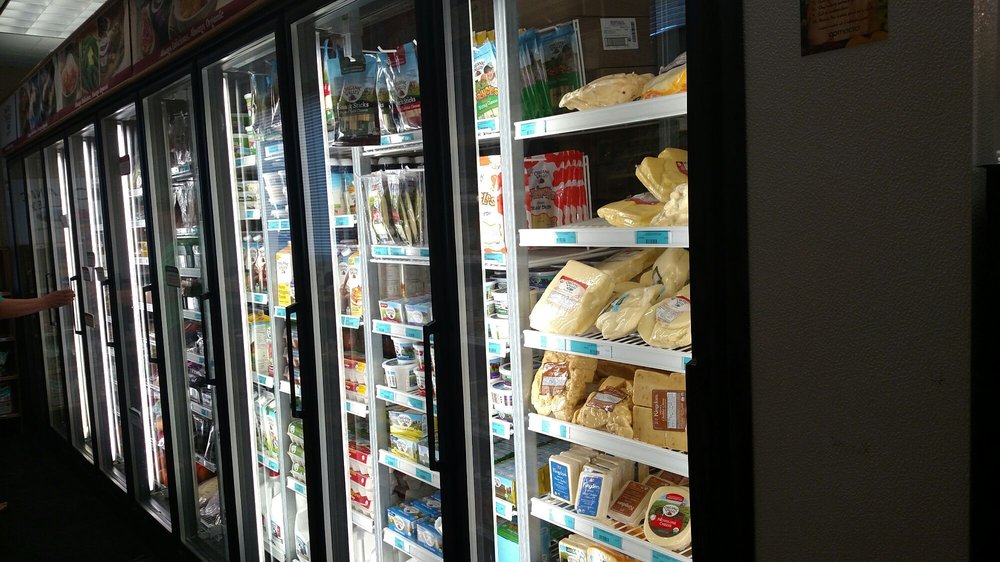
Image resolution: width=1000 pixels, height=562 pixels. I want to click on fridge door handles, so click(75, 277), click(104, 283), click(149, 285), click(49, 271), click(205, 294), click(288, 309), click(425, 324), click(695, 373).